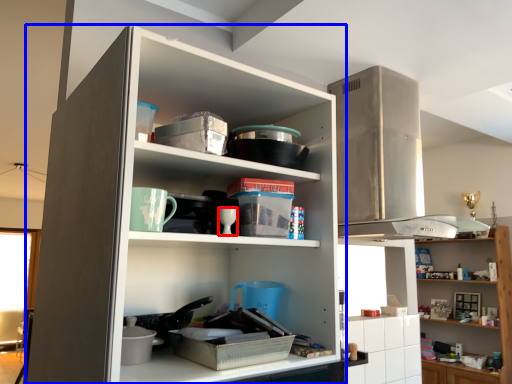
Question: Which point is closer to the camera, tableware (highlighted by a red box) or cupboard (highlighted by a blue box)?

Choices:
 (A) tableware
 (B) cupboard

Answer: (B)